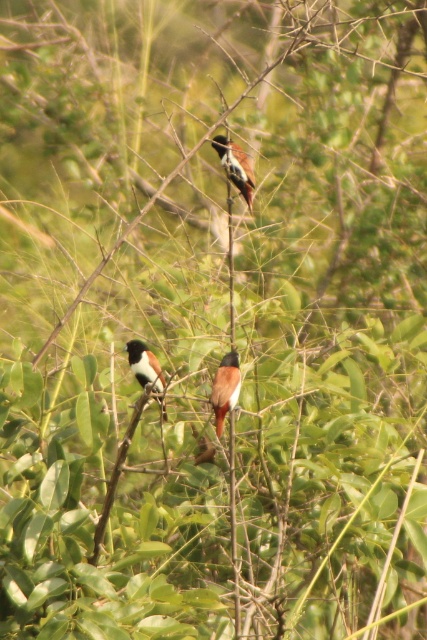
Does point (218, 154) lie in front of point (145, 385)?

No, (218, 154) is behind (145, 385).

Is brown glossy bird at center above brown and white feathers at center?

Yes.

I want to click on brown glossy bird at center, so click(x=236, y=166).

Identify the location of brown matte bird at center. The width and height of the screenshot is (427, 640). (225, 388).

Is brown matte bird at center shorter than brown and white feathers at center?

Yes, brown matte bird at center is shorter than brown and white feathers at center.

Does point (234, 396) lie behind point (160, 381)?

No.

At what (x,y) coordinates should I click in order to perform the action: click on brown matte bird at center. Please return your answer as a coordinate pair (x, y). Looking at the image, I should click on (225, 388).

Does brown matte bird at center have a lesser height compared to brown glossy bird at center?

Indeed, brown matte bird at center has a lesser height compared to brown glossy bird at center.

Is brown matte bird at center closer to camera compared to brown glossy bird at center?

Yes, it is in front of brown glossy bird at center.

What do you see at coordinates (225, 388) in the screenshot?
I see `brown matte bird at center` at bounding box center [225, 388].

Find the location of `brown matte bird at center`. brown matte bird at center is located at coordinates (225, 388).